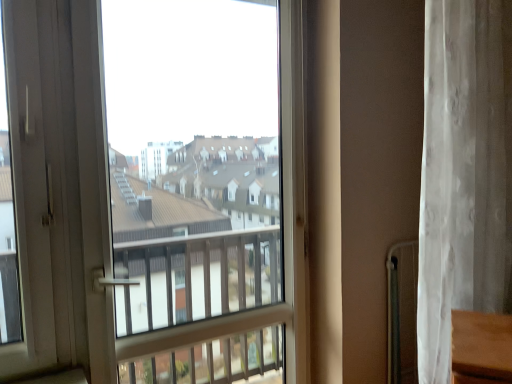
Question: From the image's perspective, is white sheer curtain at right below transparent glass window at center?

Choices:
 (A) no
 (B) yes

Answer: (A)

Question: Does white sheer curtain at right lie behind transparent glass window at center?

Choices:
 (A) yes
 (B) no

Answer: (A)

Question: Does white sheer curtain at right have a larger size compared to transparent glass window at center?

Choices:
 (A) no
 (B) yes

Answer: (B)

Question: From a real-world perspective, does white sheer curtain at right sit lower than transparent glass window at center?

Choices:
 (A) yes
 (B) no

Answer: (B)

Question: Can you confirm if white sheer curtain at right is shorter than transparent glass window at center?

Choices:
 (A) no
 (B) yes

Answer: (B)

Question: From the image's perspective, is transparent glass window at center located above or below white sheer curtain at right?

Choices:
 (A) below
 (B) above

Answer: (A)

Question: From their relative heights in the image, would you say transparent glass window at center is taller or shorter than white sheer curtain at right?

Choices:
 (A) tall
 (B) short

Answer: (A)

Question: Is transparent glass window at center inside or outside of white sheer curtain at right?

Choices:
 (A) inside
 (B) outside

Answer: (B)

Question: Looking at their shapes, would you say transparent glass window at center is wider or thinner than white sheer curtain at right?

Choices:
 (A) wide
 (B) thin

Answer: (B)

Question: Visually, is white sheer curtain at right positioned to the left or to the right of transparent glass window at center?

Choices:
 (A) left
 (B) right

Answer: (B)

Question: From a real-world perspective, is white sheer curtain at right above or below transparent glass window at center?

Choices:
 (A) above
 (B) below

Answer: (A)

Question: In the image, is white sheer curtain at right positioned in front of or behind transparent glass window at center?

Choices:
 (A) front
 (B) behind

Answer: (B)

Question: Is white sheer curtain at right spatially inside transparent glass window at center, or outside of it?

Choices:
 (A) outside
 (B) inside

Answer: (A)

Question: Relative to transparent glass window at center, is white plastic screen door at left in front or behind?

Choices:
 (A) front
 (B) behind

Answer: (A)

Question: Does point (48, 205) appear closer or farther from the camera than point (31, 39)?

Choices:
 (A) farther
 (B) closer

Answer: (A)